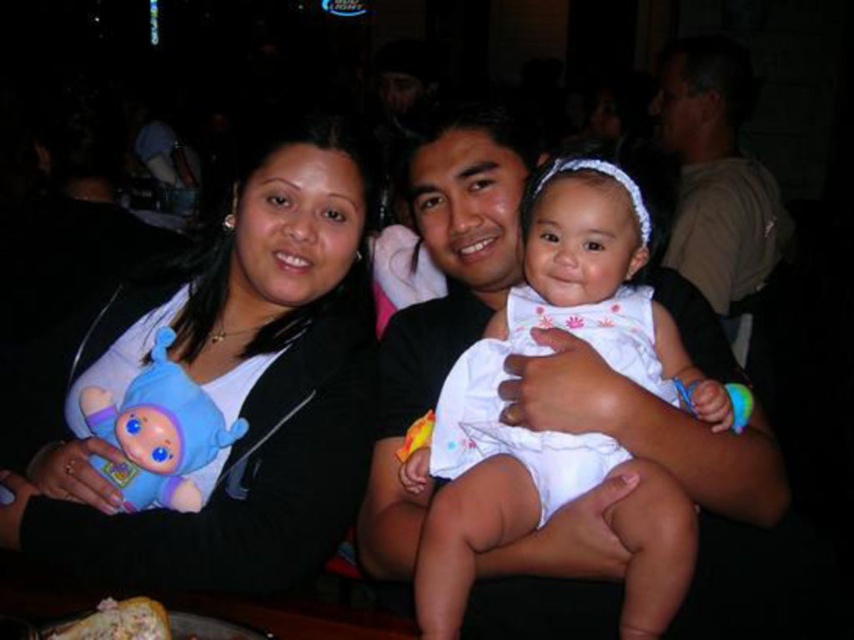
Between white cotton dress at center and blue plush toy at left, which one appears on the right side from the viewer's perspective?

white cotton dress at center is more to the right.

Between white cotton dress at center and blue plush toy at left, which one is positioned lower?

blue plush toy at left is lower down.

Which is behind, point (510, 513) or point (156, 333)?

Point (156, 333)

The image size is (854, 640). I want to click on white cotton dress at center, so click(544, 353).

Which is more to the right, white cotton dress at center or matte khaki shirt at upper right?

matte khaki shirt at upper right

Does white cotton dress at center have a greater width compared to matte khaki shirt at upper right?

In fact, white cotton dress at center might be narrower than matte khaki shirt at upper right.

Which is behind, point (647, 513) or point (755, 205)?

Point (755, 205)

This screenshot has height=640, width=854. Identify the location of white cotton dress at center. (544, 353).

Between matte black jacket at upper left and matte khaki shirt at upper right, which one has less height?

With less height is matte black jacket at upper left.

Does matte black jacket at upper left lie in front of matte khaki shirt at upper right?

Yes, matte black jacket at upper left is in front of matte khaki shirt at upper right.

The width and height of the screenshot is (854, 640). Describe the element at coordinates (221, 384) in the screenshot. I see `matte black jacket at upper left` at that location.

You are a GUI agent. You are given a task and a screenshot of the screen. Output one action in this format:
    pyautogui.click(x=<x>, y=<y>)
    Task: Click on the matte black jacket at upper left
    
    Given the screenshot: What is the action you would take?
    pyautogui.click(x=221, y=384)